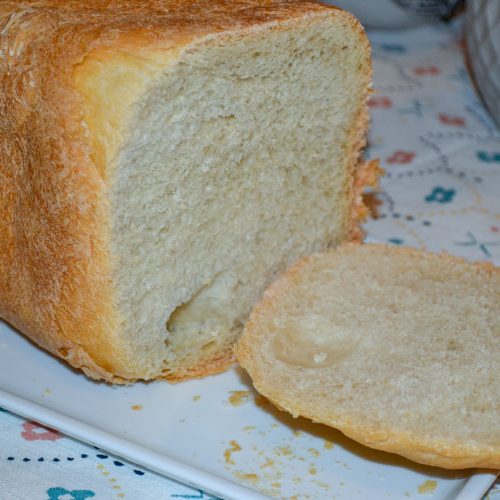
Find the location of `plate`. plate is located at coordinates (234, 447).